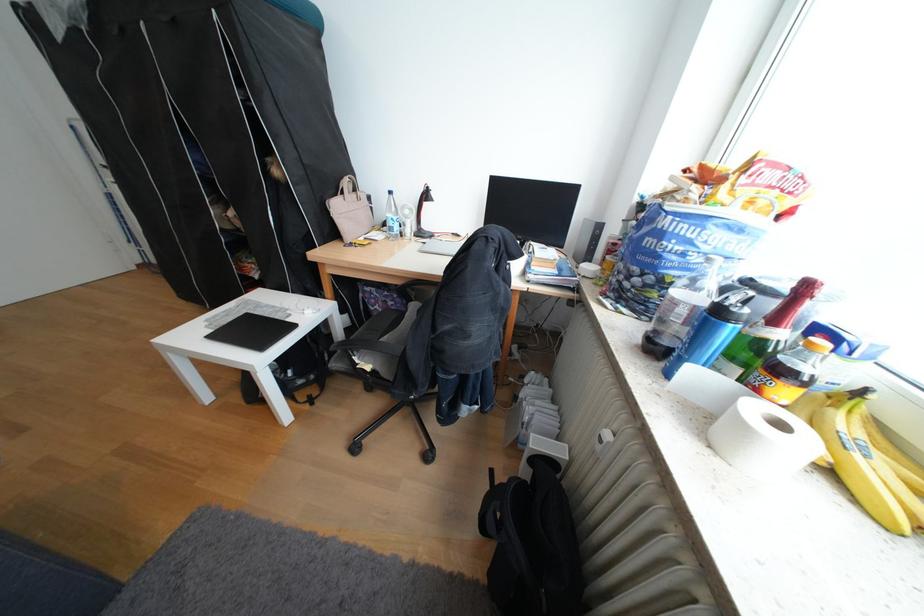
Describe the element at coordinates (368, 346) in the screenshot. Image resolution: width=924 pixels, height=616 pixels. I see `a chair armrest` at that location.